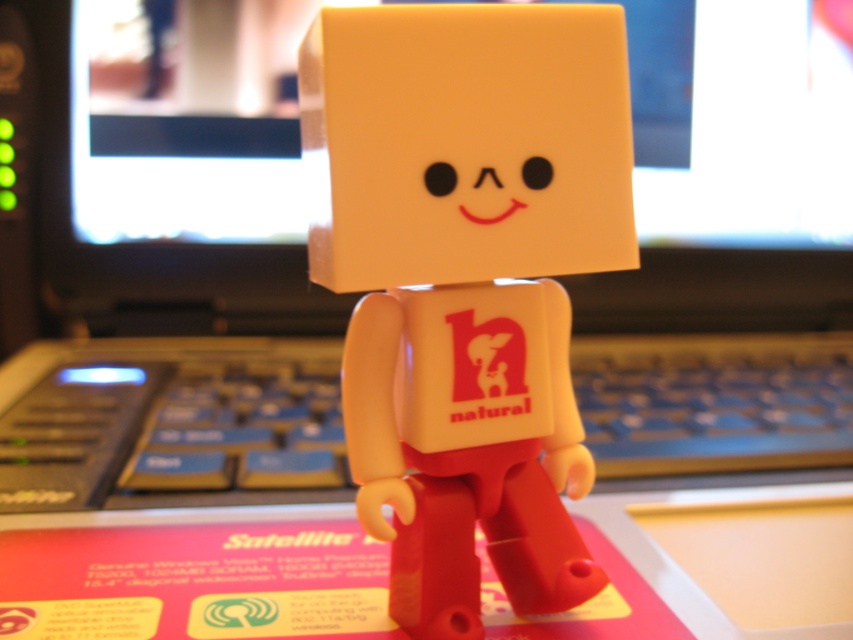
Locate an element on the screen. This screenshot has width=853, height=640. matte plastic figurine at center is located at coordinates (466, 280).

Does point (547, 141) come farther from viewer compared to point (677, 282)?

No, it is in front of (677, 282).

Who is more forward, (418, 276) or (268, 17)?

Point (418, 276)

In order to click on matte plastic figurine at center in this screenshot , I will do point(466,280).

Does matte plastic figurine at center come in front of blue plastic keyboard at center?

Yes, it is in front of blue plastic keyboard at center.

Which is behind, point (508, 486) or point (286, 468)?

Positioned behind is point (286, 468).

The width and height of the screenshot is (853, 640). Identify the location of matte plastic figurine at center. (x=466, y=280).

Can you confirm if matte black monitor at center is wider than blue plastic keyboard at center?

No, matte black monitor at center is not wider than blue plastic keyboard at center.

What do you see at coordinates (183, 154) in the screenshot?
I see `matte black monitor at center` at bounding box center [183, 154].

This screenshot has width=853, height=640. What are the coordinates of `matte black monitor at center` in the screenshot? It's located at (183, 154).